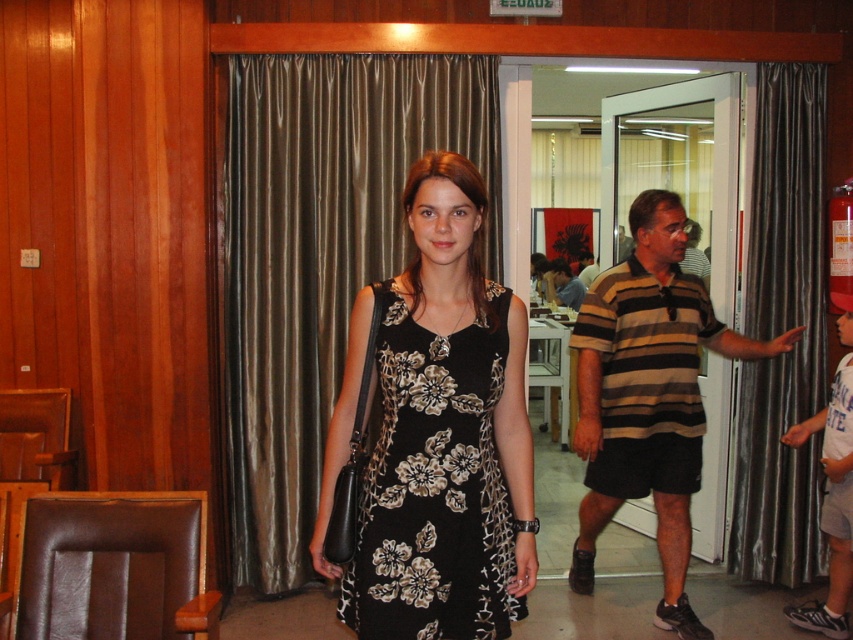
You are a photographer setting up a shoot in this room. You need to ensure that the brown silk curtain at center does not block the striped cotton shirt at center. Based on their sizes, which object should you position closer to the camera to achieve this?

The striped cotton shirt at center should be positioned closer to the camera because the brown silk curtain at center is taller. By placing the striped cotton shirt at center in front, the curtain will appear behind it and not block the shirt.